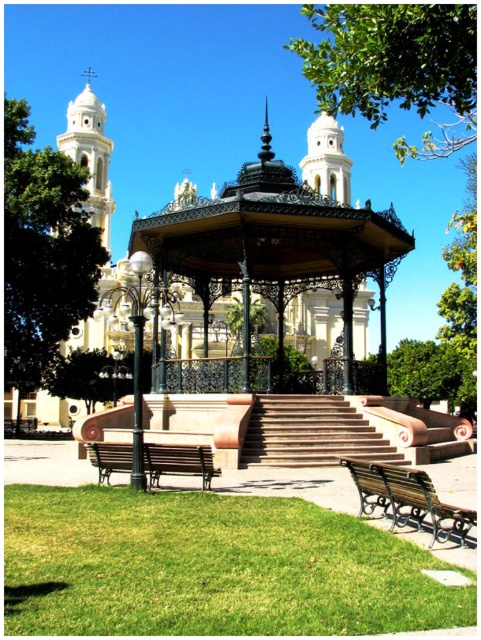
Question: Does green leafy tree at upper left have a greater width compared to wooden bench at lower left?

Choices:
 (A) no
 (B) yes

Answer: (B)

Question: Which of the following is the farthest from the observer?

Choices:
 (A) (302, 570)
 (B) (99, 449)
 (C) (404, 67)
 (D) (260, 317)

Answer: (D)

Question: Which point is farther to the camera?

Choices:
 (A) green grass at lower center
 (B) wooden bench at lower left

Answer: (B)

Question: Can you confirm if terracotta stone stairs at center is positioned above wooden bench at lower left?

Choices:
 (A) no
 (B) yes

Answer: (B)

Question: Among these points, which one is farthest from the camera?

Choices:
 (A) (323, 77)
 (B) (255, 320)
 (C) (104, 620)

Answer: (B)

Question: Does black wrought iron gazebo at center come behind green leafy tree at center?

Choices:
 (A) yes
 (B) no

Answer: (B)